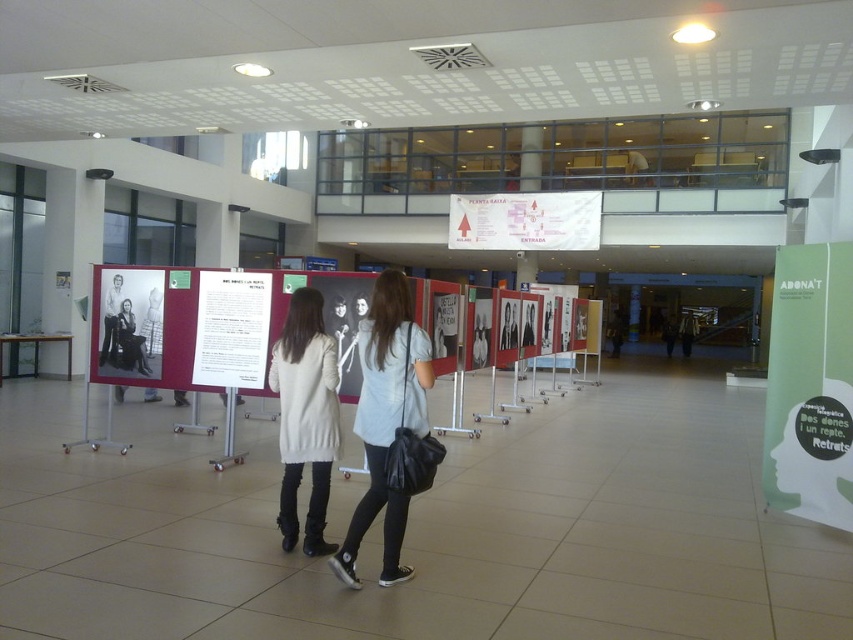
You are an event organizer planning to place a rectangular sign that is 1.2 meters wide between the matte gray shirt at center and the white paper at center. Based on the scene, will the sign fit between them without overlapping either object?

The matte gray shirt at center has a lesser width compared to white paper at center. Since the sign is 1.2 meters wide, it depends on the actual distance between them. However, the description only mentions their widths relative to each other, not the space between them. Therefore, we cannot determine if the sign will fit without additional information about the distance between the two objects.

You are a photographer at the exhibition and want to take a picture of both the matte gray shirt at center and the white paper at center. Which object should you focus on first if you want to capture them both in the same frame without moving the camera?

You should focus on the matte gray shirt at center first because it is taller than the white paper at center, ensuring both are in the frame by adjusting the camera angle or zoom accordingly.

From the picture: You are an event organizer preparing to hang a new poster in the exhibition space. You notice the green paperboard poster at right and the matte gray shirt at center. Which object is bigger in size?

The green paperboard poster at right has a larger size compared to the matte gray shirt at center.